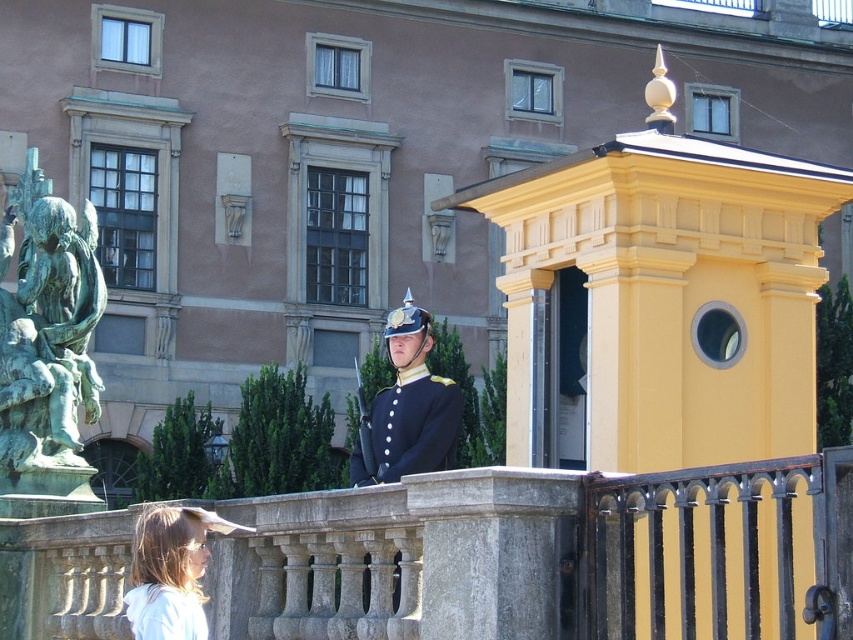
Between stone balustrade at center and matte black uniform at center, which one appears on the right side from the viewer's perspective?

From the viewer's perspective, stone balustrade at center appears more on the right side.

Does point (821, 616) lie behind point (161, 627)?

No, it is in front of (161, 627).

Locate an element on the screen. This screenshot has height=640, width=853. stone balustrade at center is located at coordinates pyautogui.click(x=547, y=556).

The image size is (853, 640). Identify the location of stone balustrade at center. (547, 556).

From the picture: Does shiny black uniform at center have a greater height compared to navy blue fabric uniform at center?

Indeed, shiny black uniform at center has a greater height compared to navy blue fabric uniform at center.

Is shiny black uniform at center thinner than navy blue fabric uniform at center?

Incorrect, shiny black uniform at center's width is not less than navy blue fabric uniform at center's.

What do you see at coordinates (405, 406) in the screenshot? I see `shiny black uniform at center` at bounding box center [405, 406].

The image size is (853, 640). What are the coordinates of `shiny black uniform at center` in the screenshot? It's located at (405, 406).

Is green patina statue at left shorter than shiny black uniform at center?

Yes, green patina statue at left is shorter than shiny black uniform at center.

From the picture: Between green patina statue at left and shiny black uniform at center, which one has less height?

green patina statue at left

Locate an element on the screen. The image size is (853, 640). green patina statue at left is located at coordinates (47, 340).